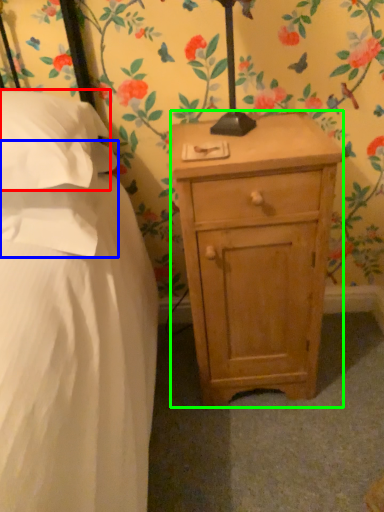
Question: Which object is positioned closest to pillow (highlighted by a red box)? Select from pillow (highlighted by a blue box) and nightstand (highlighted by a green box).

Choices:
 (A) pillow
 (B) nightstand

Answer: (A)